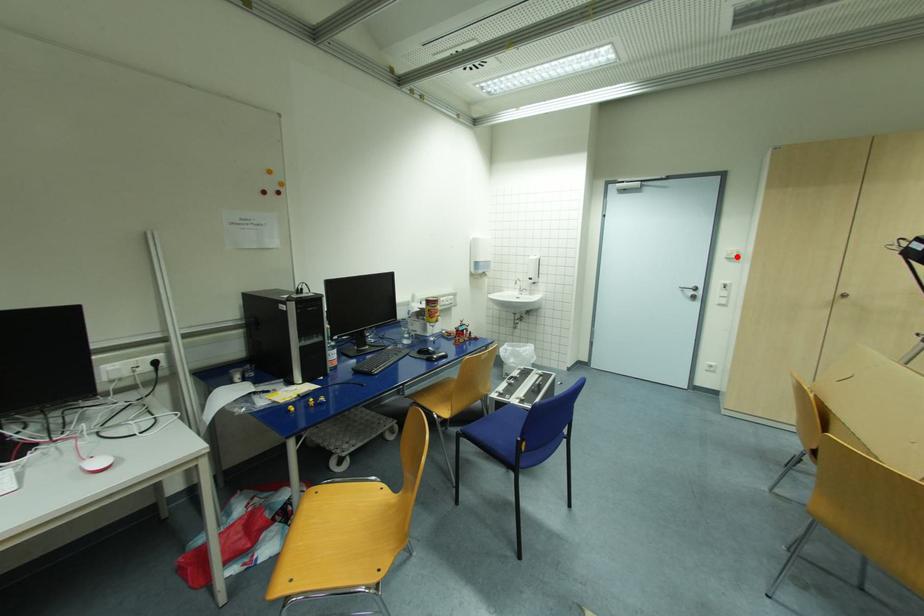
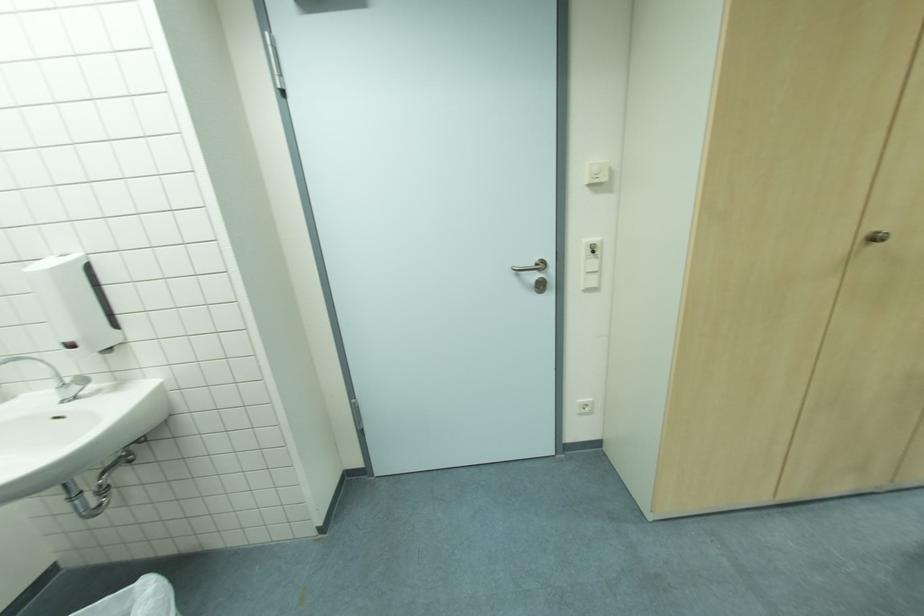
Where in the second image is the point corresponding to the highlighted location from the first image?

(608, 179)